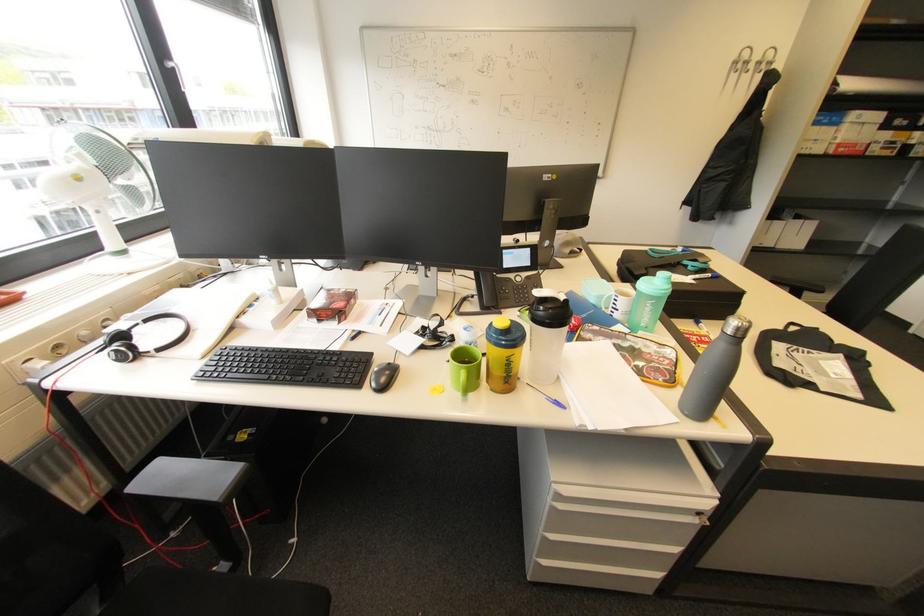
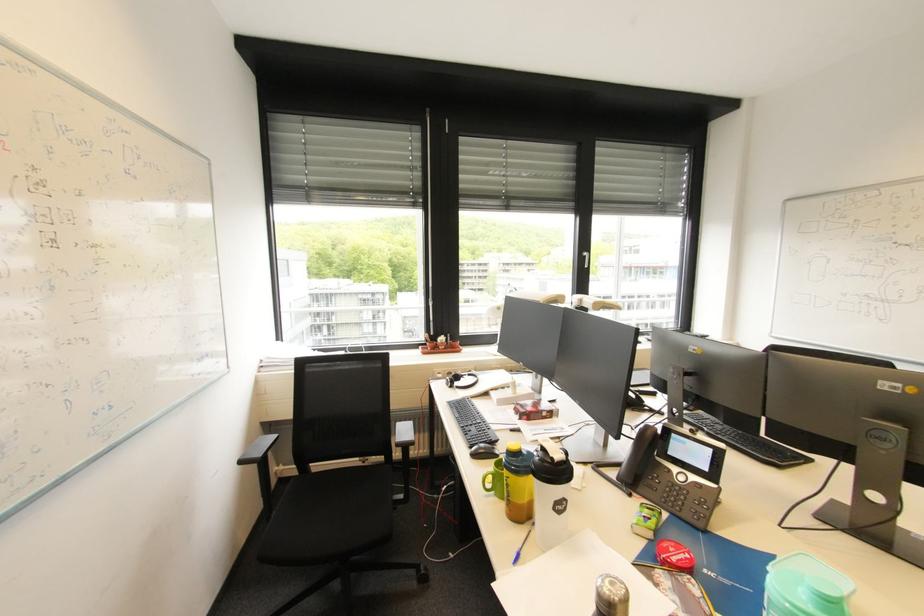
Question: The first image is from the beginning of the video and the second image is from the end. How did the camera likely rotate when shooting the video?

Choices:
 (A) Left
 (B) Right
 (C) Up
 (D) Down

Answer: (A)